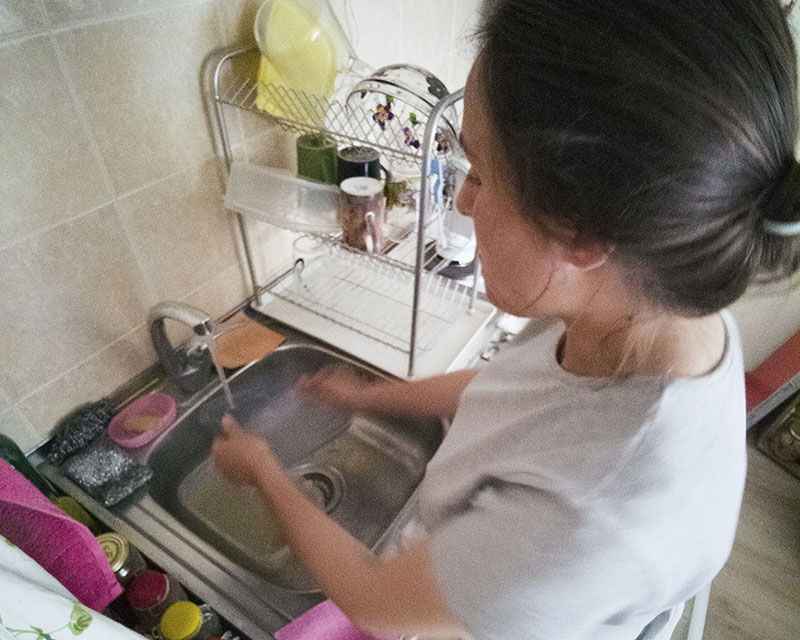
Find the location of `dish rack`. dish rack is located at coordinates (216, 86).